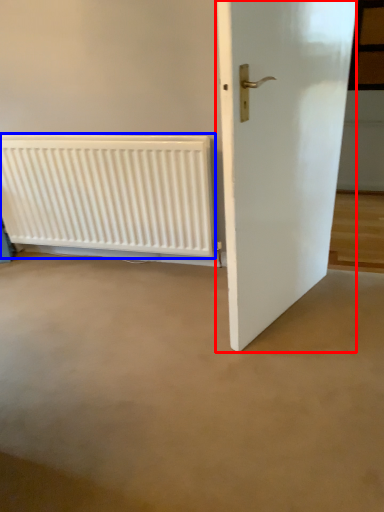
Question: Which point is closer to the camera, door (highlighted by a red box) or radiator (highlighted by a blue box)?

Choices:
 (A) door
 (B) radiator

Answer: (A)